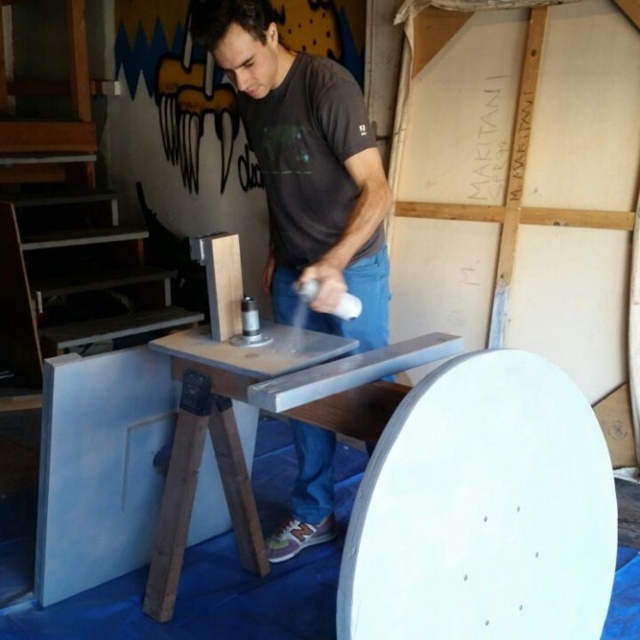
You are a tailor measuring a customer for a custom suit. The customer is wearing a matte gray shirt at center and standing in front of a metallic gray workbench at center. Which item has a greater width when viewed from the front?

The metallic gray workbench at center has a greater width than the matte gray shirt at center because the matte gray shirt at center is narrower.

You are a visitor in the workshop and notice the matte gray shirt at center and the metallic gray workbench at center. From the perspective of someone standing in front of the workbench, which object is positioned to the right?

The matte gray shirt at center is positioned to the right of the metallic gray workbench at center.